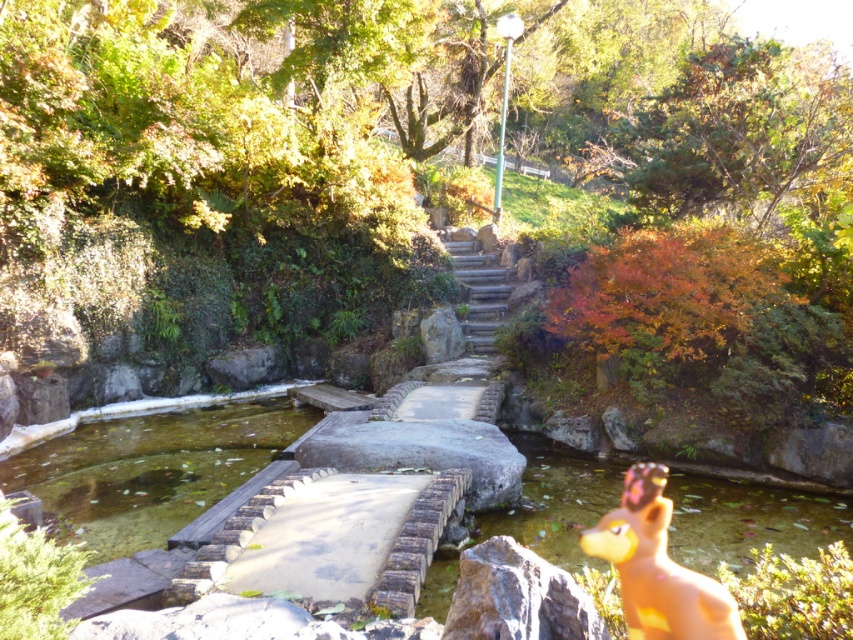
You are a gardener with a wheelbarrow that is 1.2 meters wide. You need to transport gardening tools from the smooth gray rock at lower right to the stone steps at center. Is the path between them wide enough for your wheelbarrow to pass through?

The distance between the smooth gray rock at lower right and the stone steps at center is 9.17 meters. Since the wheelbarrow is only 1.2 meters wide, the path is more than wide enough for the wheelbarrow to pass through safely.

You are a hiker who wants to step onto the stone steps at center but first must pass by the smooth gray rock at lower right. Which object is lower in height so you can step over it easily?

The smooth gray rock at lower right is shorter than the stone steps at center, so you can easily step over it.

You are a child playing in the park and see the light brown plastic toy at lower right and the stone steps at center. Which object is shorter in height?

The light brown plastic toy at lower right has a lesser height compared to the stone steps at center, so the light brown plastic toy at lower right is shorter.